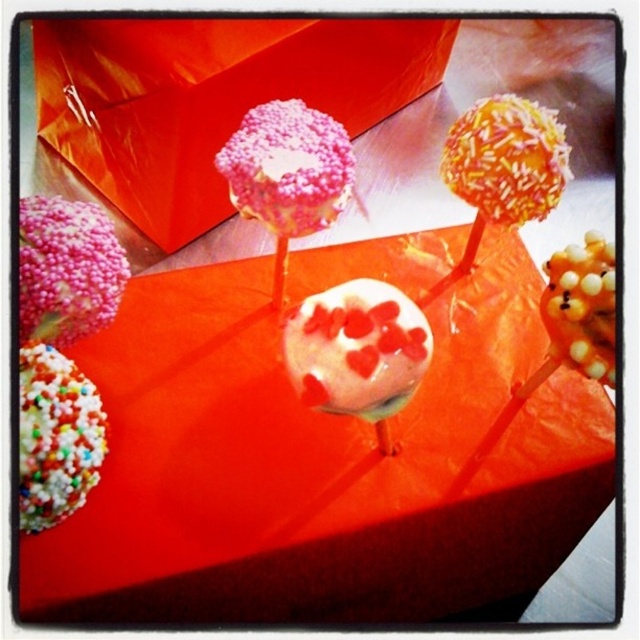
Question: Does white glossy heart-shaped candy at center lie in front of pink sprinkled lollipop at upper center?

Choices:
 (A) yes
 (B) no

Answer: (A)

Question: Which of the following is the farthest from the observer?

Choices:
 (A) white glossy heart-shaped candy at center
 (B) multicolored sprinkles at lower left
 (C) pink sprinkled lollipop at upper center
 (D) white glossy cake pop at center

Answer: (D)

Question: Considering the real-world distances, which object is farthest from the pink sprinkled candy at center?

Choices:
 (A) white glossy heart-shaped candy at center
 (B) pink sprinkled lollipop at upper center

Answer: (A)

Question: Observing the image, what is the correct spatial positioning of multicolored sprinkles at lower left in reference to yellow pearlized beads at center?

Choices:
 (A) left
 (B) right

Answer: (A)

Question: Which point is closer to the camera?

Choices:
 (A) yellow pearlized beads at center
 (B) white glossy heart-shaped candy at center
 (C) pink sprinkled candy at center
 (D) white glossy cake pop at center

Answer: (C)

Question: Observing the image, what is the correct spatial positioning of pink sprinkled candy at center in reference to multicolored sprinkles at lower left?

Choices:
 (A) right
 (B) left

Answer: (B)